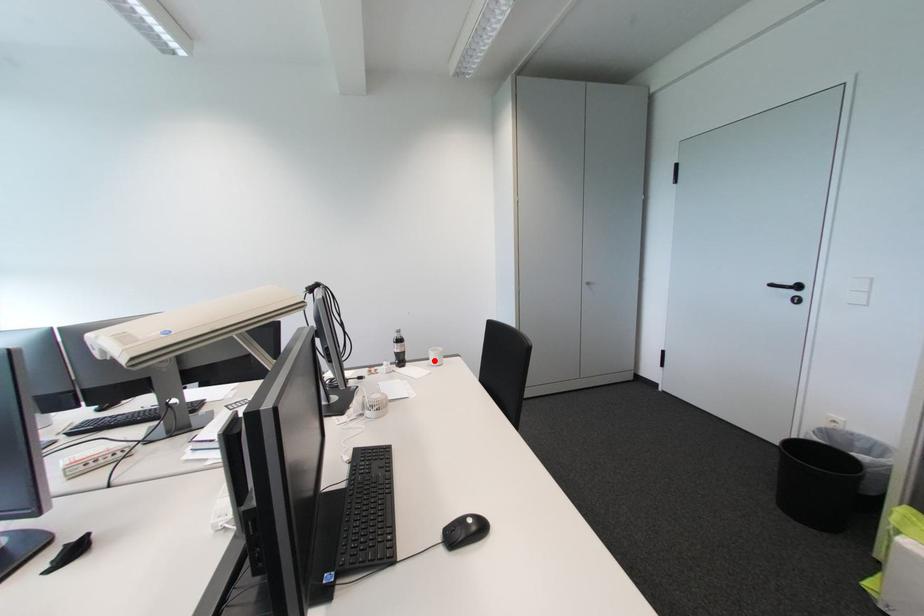
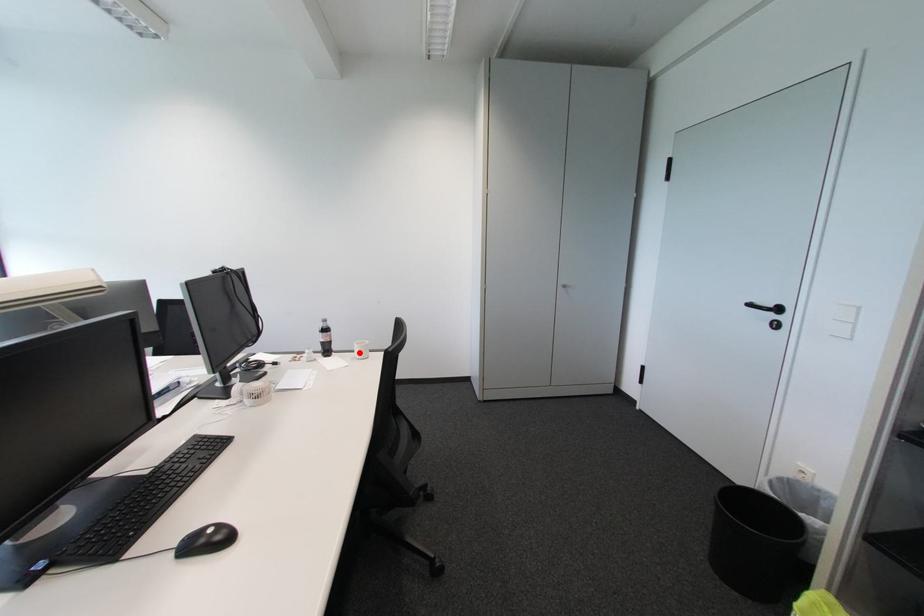
I am providing you with two images of the same scene from different viewpoints. A red point is marked on the first image and another point is marked on the second image. Is the red point in image1 aligned with the point shown in image2?

Yes